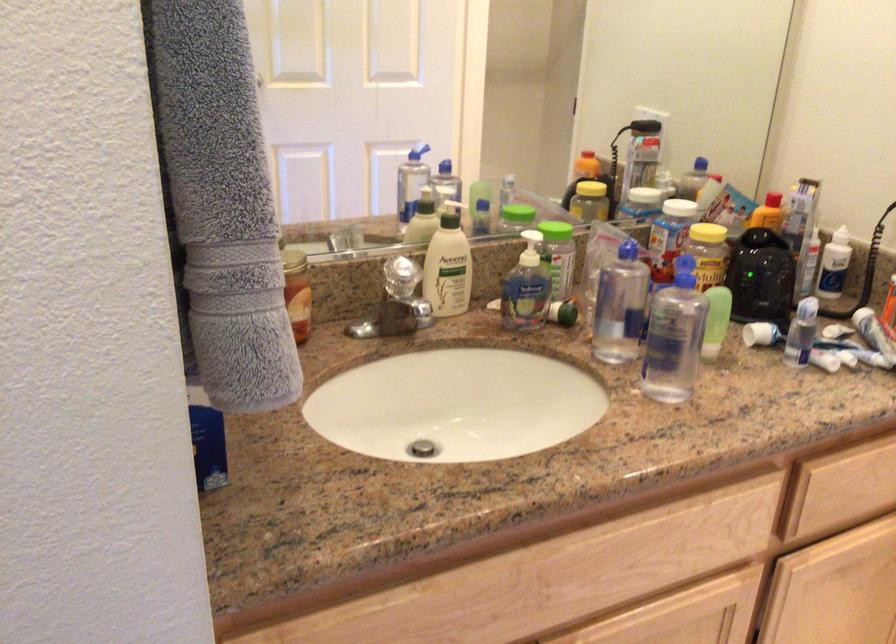
Describe the element at coordinates (707, 232) in the screenshot. This screenshot has width=896, height=644. I see `a yellow jar lid` at that location.